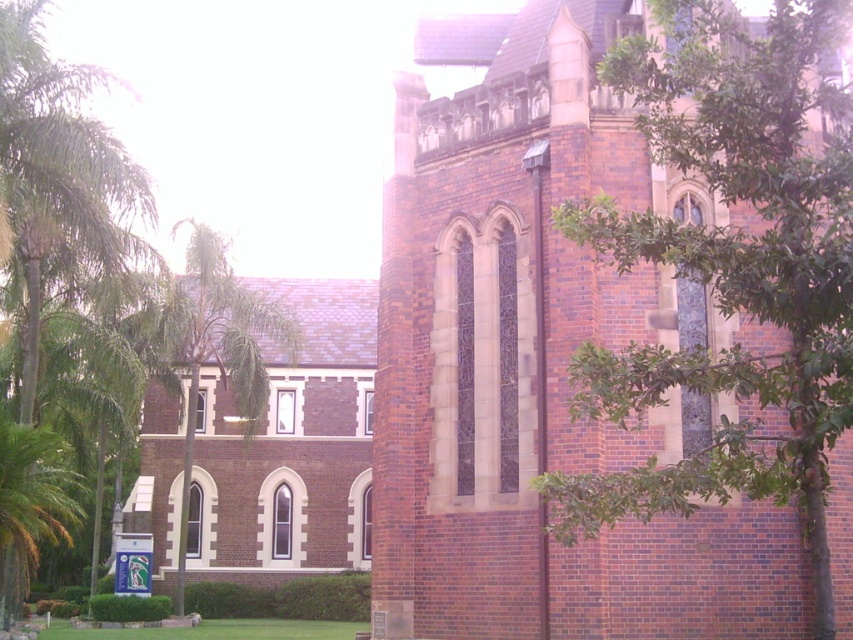
Looking at this image, you are a landscape architect planning to plant a new tree that requires at least 50 meters of space between it and the nearest existing tree. You see the green leafy tree at right and the green leafy tree at center. Can you plant the new tree between them without violating the spacing requirement?

The green leafy tree at right is 51.04 meters from green leafy tree at center, so yes, you can plant the new tree between them since the distance between the two existing trees is more than the required 50 meters spacing.

You are standing in front of a historic brick building with a green leafy tree at right. You want to take a photo that includes both the building and the tree. If your camera can capture a maximum distance of 20 meters, will the tree be fully visible in the photo?

The green leafy tree at right is 22.70 meters from the camera, which exceeds the camera maximum distance of 20 meters. Therefore, the tree will not be fully visible in the photo.

You are standing in front of the historic brick building and want to take a photo that includes both the green leafy tree at right and the pointed arches of the building. Based on their positions, will the tree be to the left or right of the arches in the photo?

The green leafy tree at right is located at point (x=730, y=266), which means it is positioned to the right side of the image. Since the pointed arches are part of the building itself, which is centered, the tree will appear to the right of the arches in the photo.